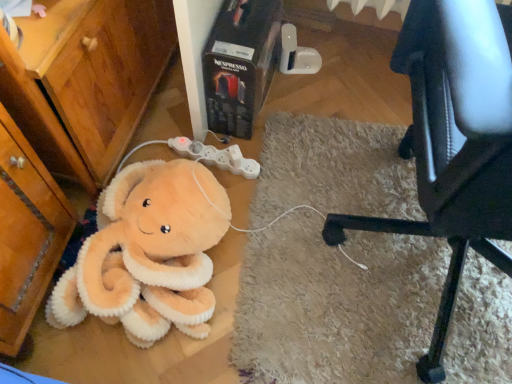
Question: Considering the relative sizes of white plastic game controller at center and soft plush octopus at lower left in the image provided, is white plastic game controller at center bigger than soft plush octopus at lower left?

Choices:
 (A) no
 (B) yes

Answer: (A)

Question: From the image's perspective, would you say white plastic game controller at center is shown under soft plush octopus at lower left?

Choices:
 (A) no
 (B) yes

Answer: (A)

Question: From the image's perspective, is white plastic game controller at center above soft plush octopus at lower left?

Choices:
 (A) yes
 (B) no

Answer: (A)

Question: Is white plastic game controller at center located outside soft plush octopus at lower left?

Choices:
 (A) yes
 (B) no

Answer: (A)

Question: Is white plastic game controller at center shorter than soft plush octopus at lower left?

Choices:
 (A) no
 (B) yes

Answer: (B)

Question: Is black leather chair at lower right situated inside white plastic game controller at center or outside?

Choices:
 (A) outside
 (B) inside

Answer: (A)

Question: Considering the positions of black leather chair at lower right and white plastic game controller at center in the image, is black leather chair at lower right wider or thinner than white plastic game controller at center?

Choices:
 (A) thin
 (B) wide

Answer: (B)

Question: Is black leather chair at lower right bigger or smaller than white plastic game controller at center?

Choices:
 (A) small
 (B) big

Answer: (B)

Question: Considering the positions of black leather chair at lower right and white plastic game controller at center in the image, is black leather chair at lower right taller or shorter than white plastic game controller at center?

Choices:
 (A) tall
 (B) short

Answer: (A)

Question: Is white plastic game controller at center taller or shorter than soft plush octopus at lower left?

Choices:
 (A) tall
 (B) short

Answer: (B)

Question: In the image, is white plastic game controller at center on the left side or the right side of soft plush octopus at lower left?

Choices:
 (A) right
 (B) left

Answer: (A)

Question: From a real-world perspective, is white plastic game controller at center positioned above or below soft plush octopus at lower left?

Choices:
 (A) below
 (B) above

Answer: (A)

Question: In terms of size, does white plastic game controller at center appear bigger or smaller than soft plush octopus at lower left?

Choices:
 (A) big
 (B) small

Answer: (B)

Question: From a real-world perspective, relative to white plastic game controller at center, is soft plush octopus at lower left vertically above or below?

Choices:
 (A) above
 (B) below

Answer: (A)

Question: Considering the positions of soft plush octopus at lower left and white plastic game controller at center in the image, is soft plush octopus at lower left bigger or smaller than white plastic game controller at center?

Choices:
 (A) big
 (B) small

Answer: (A)